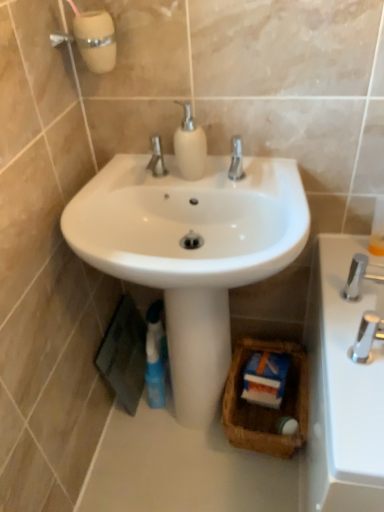
Question: Is blue glossy mouthwash at lower center behind chrome metallic faucet at right, which is counted as the 1th tap, starting from the front?

Choices:
 (A) yes
 (B) no

Answer: (A)

Question: Does blue glossy mouthwash at lower center lie in front of chrome metallic faucet at right, the second tap viewed from the back?

Choices:
 (A) no
 (B) yes

Answer: (A)

Question: Considering the relative sizes of blue glossy mouthwash at lower center and chrome metallic faucet at right, which is counted as the 1th tap, starting from the front, in the image provided, is blue glossy mouthwash at lower center bigger than chrome metallic faucet at right, which is counted as the 1th tap, starting from the front,?

Choices:
 (A) no
 (B) yes

Answer: (B)

Question: Considering the relative sizes of blue glossy mouthwash at lower center and chrome metallic faucet at right, which is counted as the 1th tap, starting from the front, in the image provided, is blue glossy mouthwash at lower center shorter than chrome metallic faucet at right, which is counted as the 1th tap, starting from the front,?

Choices:
 (A) no
 (B) yes

Answer: (A)

Question: Is blue glossy mouthwash at lower center far from chrome metallic faucet at right, which is counted as the 1th tap, starting from the front?

Choices:
 (A) no
 (B) yes

Answer: (A)

Question: From a real-world perspective, is brown woven basket at center positioned above or below chrome metallic faucet at right, which is counted as the 1th tap, starting from the front?

Choices:
 (A) above
 (B) below

Answer: (B)

Question: Based on their positions, is brown woven basket at center located to the left or right of chrome metallic faucet at right, the second tap viewed from the back?

Choices:
 (A) left
 (B) right

Answer: (A)

Question: From their relative heights in the image, would you say brown woven basket at center is taller or shorter than chrome metallic faucet at right, which is counted as the 1th tap, starting from the front?

Choices:
 (A) short
 (B) tall

Answer: (B)

Question: Does point (291, 435) appear closer or farther from the camera than point (372, 311)?

Choices:
 (A) closer
 (B) farther

Answer: (B)

Question: In terms of height, does chrome metallic faucet at right, which is counted as the 1th tap, starting from the front, look taller or shorter compared to white matte soap dispenser at center?

Choices:
 (A) short
 (B) tall

Answer: (A)

Question: Relative to white matte soap dispenser at center, is chrome metallic faucet at right, which is counted as the 1th tap, starting from the front, in front or behind?

Choices:
 (A) behind
 (B) front

Answer: (B)

Question: From a real-world perspective, relative to white matte soap dispenser at center, is chrome metallic faucet at right, which is counted as the 1th tap, starting from the front, vertically above or below?

Choices:
 (A) above
 (B) below

Answer: (B)

Question: Considering the positions of chrome metallic faucet at right, the second tap viewed from the back, and white matte soap dispenser at center in the image, is chrome metallic faucet at right, the second tap viewed from the back, wider or thinner than white matte soap dispenser at center?

Choices:
 (A) thin
 (B) wide

Answer: (B)

Question: From the image's perspective, relative to brown woven basket at center, is chrome metallic faucet at right, the second tap viewed from the back, above or below?

Choices:
 (A) above
 (B) below

Answer: (A)

Question: Looking at the image, does chrome metallic faucet at right, the second tap viewed from the back, seem bigger or smaller compared to brown woven basket at center?

Choices:
 (A) big
 (B) small

Answer: (B)